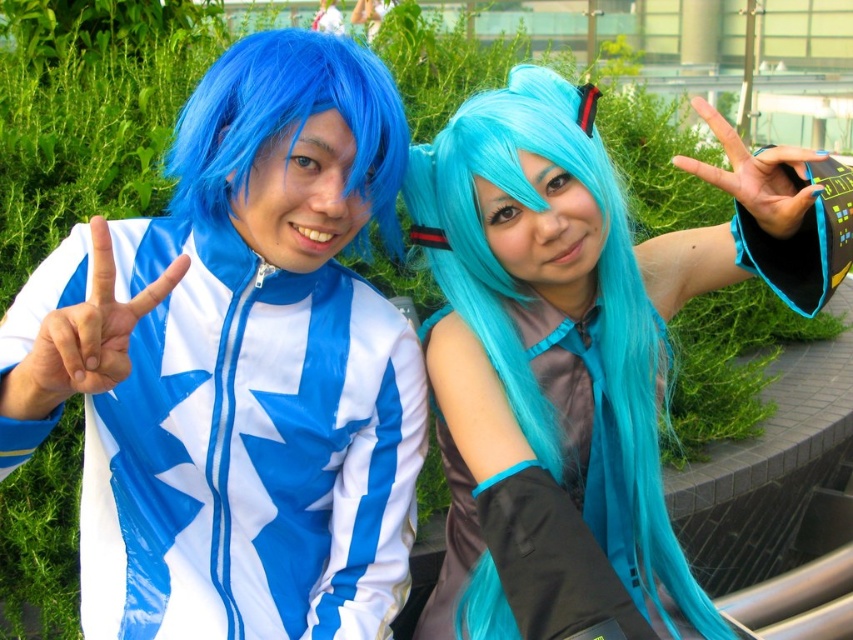
Question: Observing the image, what is the correct spatial positioning of teal glossy wig at center in reference to shiny plastic jacket at center?

Choices:
 (A) below
 (B) above

Answer: (B)

Question: Does shiny plastic jacket at center appear under satin teal dress at center?

Choices:
 (A) yes
 (B) no

Answer: (B)

Question: Which point appears closest to the camera in this image?

Choices:
 (A) (206, 422)
 (B) (515, 156)

Answer: (B)

Question: Which object is farther from the camera taking this photo?

Choices:
 (A) satin teal dress at center
 (B) shiny plastic jacket at center
 (C) teal glossy wig at center

Answer: (A)

Question: Can you confirm if teal glossy wig at center is thinner than blue synthetic wig at left?

Choices:
 (A) yes
 (B) no

Answer: (B)

Question: Which point is closer to the camera?

Choices:
 (A) (225, 100)
 (B) (200, 392)
 (C) (525, 129)
 (D) (631, 584)

Answer: (A)